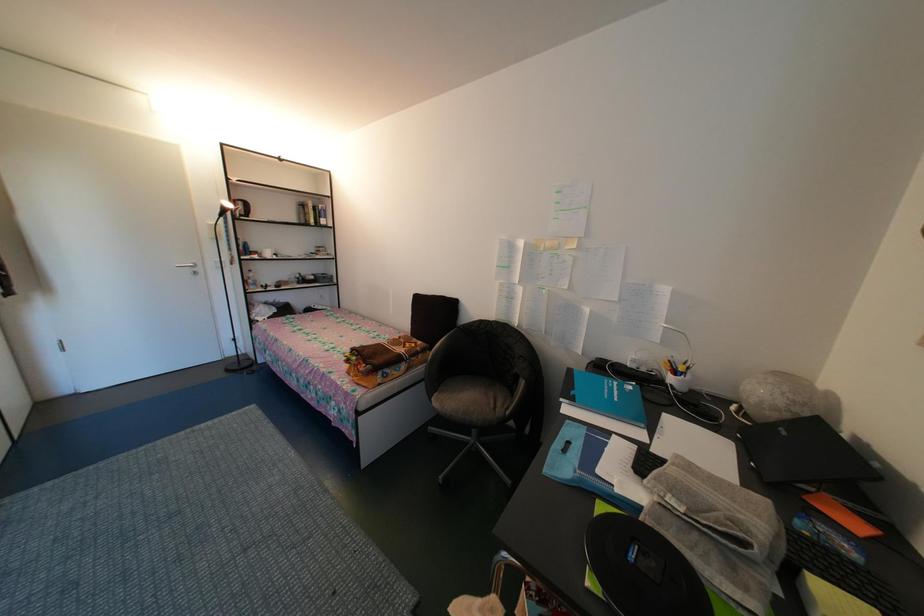
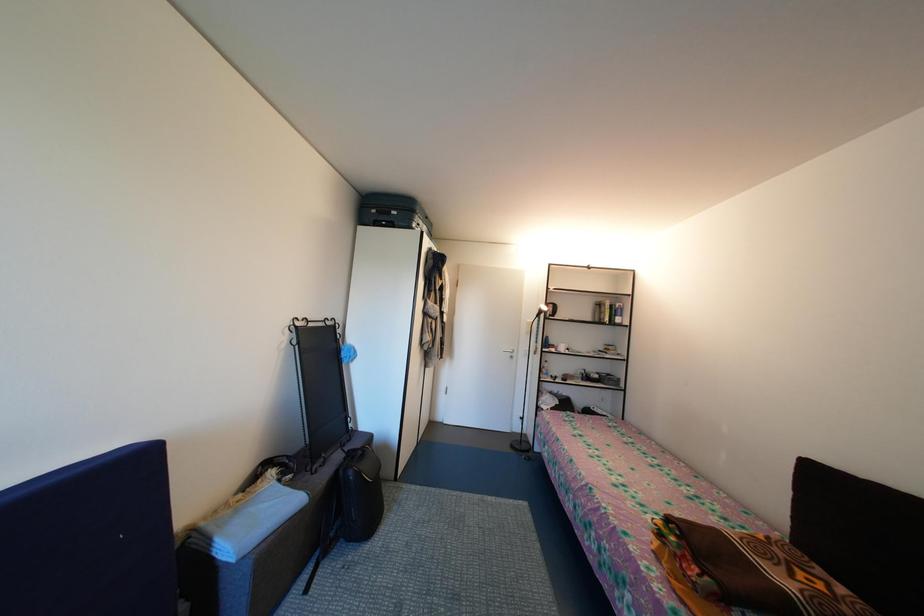
Question: The first image is from the beginning of the video and the second image is from the end. How did the camera likely rotate when shooting the video?

Choices:
 (A) Left
 (B) Right
 (C) Up
 (D) Down

Answer: (A)